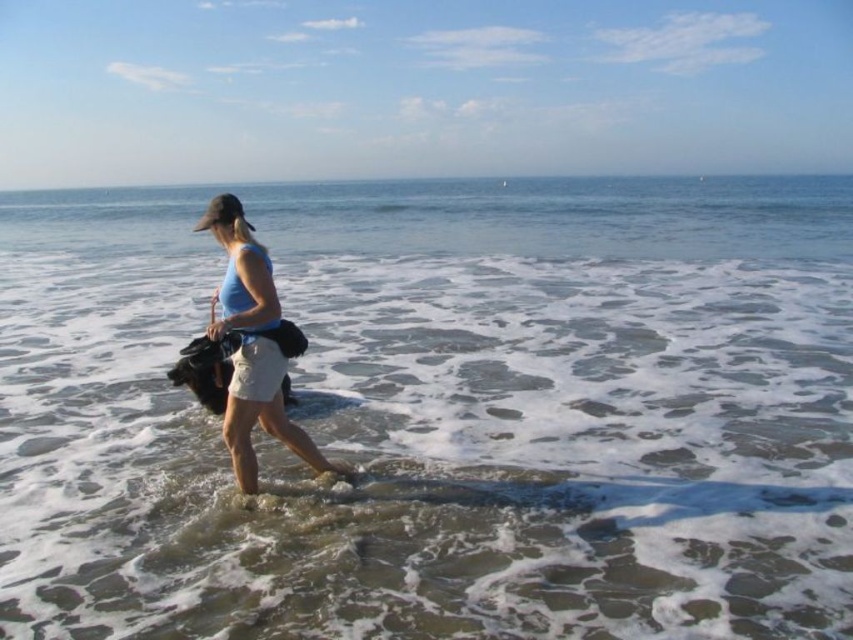
Can you confirm if clear water at center is positioned below blue fabric shorts at center?

Incorrect, clear water at center is not positioned below blue fabric shorts at center.

Who is shorter, clear water at center or blue fabric shorts at center?

blue fabric shorts at center

Find the location of `clear water at center`. clear water at center is located at coordinates (440, 413).

The height and width of the screenshot is (640, 853). I want to click on clear water at center, so click(440, 413).

Does clear water at center appear on the left side of light beige cotton skirt at center?

In fact, clear water at center is to the right of light beige cotton skirt at center.

Is clear water at center above light beige cotton skirt at center?

Yes, clear water at center is above light beige cotton skirt at center.

Is point (80, 211) farther from viewer compared to point (241, 278)?

Yes, it is.

I want to click on clear water at center, so click(x=440, y=413).

Can you confirm if blue fabric shorts at center is wider than light beige cotton skirt at center?

Yes.

Does blue fabric shorts at center have a smaller size compared to light beige cotton skirt at center?

No.

Who is more distant from viewer, (256, 241) or (254, 292)?

The point (256, 241) is behind.

I want to click on blue fabric shorts at center, so click(x=253, y=344).